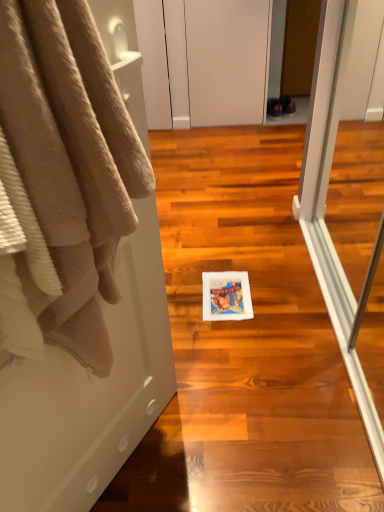
This screenshot has width=384, height=512. What do you see at coordinates (254, 332) in the screenshot?
I see `white paper towel at center` at bounding box center [254, 332].

At what (x,y) coordinates should I click in order to perform the action: click on white matte cabinet at upper center. Please return your answer as a coordinate pair (x, y). The width and height of the screenshot is (384, 512). Looking at the image, I should click on (228, 60).

Between beige plush towel at left and white paper towel at center, which one has smaller size?

beige plush towel at left is smaller.

Is beige plush towel at left in front of or behind white paper towel at center in the image?

→ Visually, beige plush towel at left is located in front of white paper towel at center.

Which is more to the right, beige plush towel at left or white paper towel at center?

white paper towel at center.

From the image's perspective, would you say beige plush towel at left is positioned over white paper towel at center?

No.

Who is smaller, white paper towel at center or beige plush towel at left?

With smaller size is beige plush towel at left.

Does white paper towel at center lie behind beige plush towel at left?

Yes, white paper towel at center is further from the camera.

In the scene shown: Would you say white paper towel at center is outside beige plush towel at left?

white paper towel at center is positioned outside beige plush towel at left.

Is white paper towel at center completely or partially outside of white matte cabinet at upper center?

Yes, white paper towel at center is located beyond the bounds of white matte cabinet at upper center.

Locate an element on the screen. screen door above the white paper towel at center (from a real-world perspective) is located at coordinates (228, 60).

From a real-world perspective, which object stands above the other?

white matte cabinet at upper center is physically above.

Which is in front, point (242, 424) or point (261, 59)?

The point (242, 424) is closer to the camera.

Does white matte cabinet at upper center touch beige plush towel at left?

white matte cabinet at upper center and beige plush towel at left are clearly separated.

Which is in front, white matte cabinet at upper center or beige plush towel at left?

beige plush towel at left is closer to the camera.

Consider the image. Is white matte cabinet at upper center to the right of beige plush towel at left from the viewer's perspective?

Yes, white matte cabinet at upper center is to the right of beige plush towel at left.

From the picture: From a real-world perspective, between white matte cabinet at upper center and white paper towel at center, who is vertically higher?

white matte cabinet at upper center, from a real-world perspective.

Is white matte cabinet at upper center positioned with its back to white paper towel at center?

No, white matte cabinet at upper center's orientation is not away from white paper towel at center.

Is white matte cabinet at upper center further to camera compared to white paper towel at center?

That is True.

Looking at this image, is the position of beige plush towel at left less distant than that of white matte cabinet at upper center?

Yes, beige plush towel at left is closer to the camera.

From the image's perspective, is beige plush towel at left above or below white matte cabinet at upper center?

beige plush towel at left is below white matte cabinet at upper center.

Is beige plush towel at left taller or shorter than white matte cabinet at upper center?

Considering their sizes, beige plush towel at left has less height than white matte cabinet at upper center.

Identify the location of towel above the white paper towel at center (from a real-world perspective). The height and width of the screenshot is (512, 384). (64, 176).

Identify the location of stair lying behind the beige plush towel at left. (254, 332).

From the picture: Which object lies further to the anchor point beige plush towel at left, white paper towel at center or white matte cabinet at upper center?

white matte cabinet at upper center is further to beige plush towel at left.

Based on their spatial positions, is white matte cabinet at upper center or white paper towel at center closer to beige plush towel at left?

white paper towel at center lies closer to beige plush towel at left than the other object.

Estimate the real-world distances between objects in this image. Which object is further from white matte cabinet at upper center, white paper towel at center or beige plush towel at left?

beige plush towel at left is further to white matte cabinet at upper center.

When comparing their distances from white matte cabinet at upper center, does beige plush towel at left or white paper towel at center seem closer?

white paper towel at center lies closer to white matte cabinet at upper center than the other object.

Which object lies further to the anchor point white paper towel at center, beige plush towel at left or white matte cabinet at upper center?

Among the two, white matte cabinet at upper center is located further to white paper towel at center.

Estimate the real-world distances between objects in this image. Which object is further from white paper towel at center, white matte cabinet at upper center or beige plush towel at left?

white matte cabinet at upper center.

Find the location of `stair between beige plush towel at left and white matte cabinet at upper center in the front-back direction`. stair between beige plush towel at left and white matte cabinet at upper center in the front-back direction is located at coordinates (254, 332).